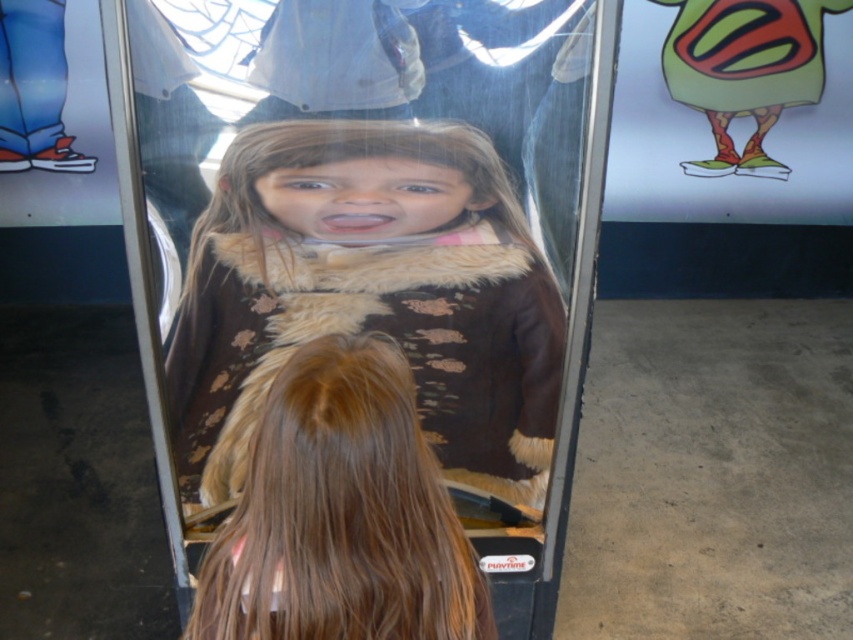
Measure the distance from brown fuzzy coat at center to transparent plastic glass at center.

4.86 centimeters

Identify the location of brown fuzzy coat at center. The height and width of the screenshot is (640, 853). point(369,294).

Is point (480, 374) positioned before point (457, 408)?

Yes.

Where is `brown fuzzy coat at center`? The image size is (853, 640). brown fuzzy coat at center is located at coordinates (369, 294).

Is transparent plastic glass at center shorter than smooth brown coat at center?

No, transparent plastic glass at center is not shorter than smooth brown coat at center.

Is point (419, 356) in front of point (387, 547)?

No, it is behind (387, 547).

Who is more distant from viewer, (199,500) or (277,372)?

Point (199,500)

Image resolution: width=853 pixels, height=640 pixels. In order to click on transparent plastic glass at center in this screenshot , I will do `click(395, 337)`.

Does brown fuzzy coat at center appear under smooth brown coat at center?

No.

Is brown fuzzy coat at center positioned behind smooth brown coat at center?

Yes, it is.

Between point (546, 333) and point (477, 595), which one is positioned behind?

The point (546, 333) is behind.

Locate an element on the screen. Image resolution: width=853 pixels, height=640 pixels. brown fuzzy coat at center is located at coordinates (369, 294).